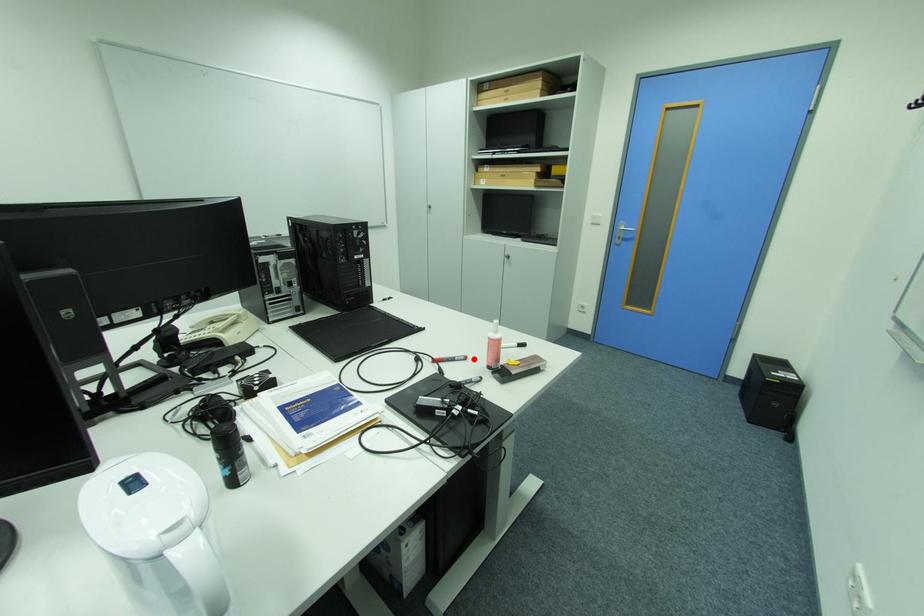
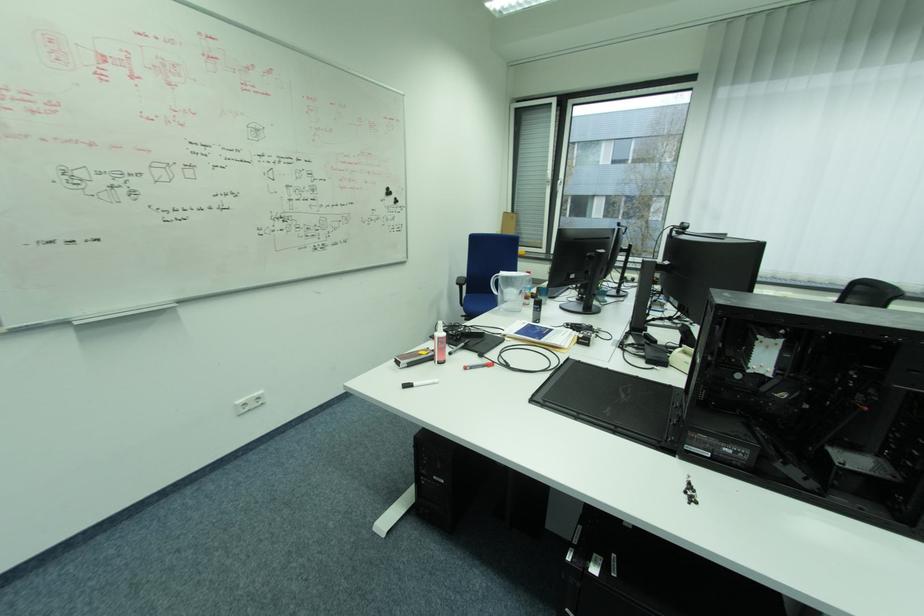
Locate, in the second image, the point that corresponds to the highlighted location in the first image.

(472, 369)